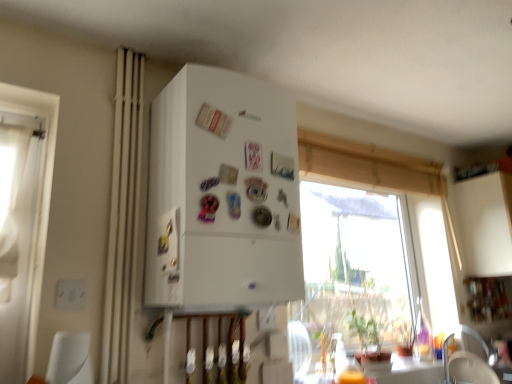
Question: Is white matte refrigerator at center at the back of white fabric armchair at lower right?

Choices:
 (A) no
 (B) yes

Answer: (A)

Question: Does white fabric armchair at lower right turn towards white matte refrigerator at center?

Choices:
 (A) no
 (B) yes

Answer: (A)

Question: Is white fabric armchair at lower right smaller than white matte refrigerator at center?

Choices:
 (A) no
 (B) yes

Answer: (B)

Question: From the image's perspective, does white fabric armchair at lower right appear higher than white matte refrigerator at center?

Choices:
 (A) yes
 (B) no

Answer: (B)

Question: Is white fabric armchair at lower right closer to the viewer compared to white matte refrigerator at center?

Choices:
 (A) no
 (B) yes

Answer: (A)

Question: Is white fabric armchair at lower right inside the boundaries of beige fabric curtain at left, or outside?

Choices:
 (A) inside
 (B) outside

Answer: (B)

Question: Would you say white fabric armchair at lower right is to the left or to the right of beige fabric curtain at left in the picture?

Choices:
 (A) left
 (B) right

Answer: (B)

Question: From their relative heights in the image, would you say white fabric armchair at lower right is taller or shorter than beige fabric curtain at left?

Choices:
 (A) short
 (B) tall

Answer: (A)

Question: In the image, is white fabric armchair at lower right positioned in front of or behind beige fabric curtain at left?

Choices:
 (A) behind
 (B) front

Answer: (A)

Question: Is white matte refrigerator at center taller or shorter than beige fabric curtain at left?

Choices:
 (A) tall
 (B) short

Answer: (B)

Question: Considering the positions of white matte refrigerator at center and beige fabric curtain at left in the image, is white matte refrigerator at center wider or thinner than beige fabric curtain at left?

Choices:
 (A) thin
 (B) wide

Answer: (B)

Question: In terms of size, does white matte refrigerator at center appear bigger or smaller than beige fabric curtain at left?

Choices:
 (A) big
 (B) small

Answer: (A)

Question: From a real-world perspective, is white matte refrigerator at center physically located above or below beige fabric curtain at left?

Choices:
 (A) below
 (B) above

Answer: (B)

Question: In terms of width, does white matte refrigerator at center look wider or thinner when compared to transparent glass window at upper center?

Choices:
 (A) thin
 (B) wide

Answer: (B)

Question: Would you say white matte refrigerator at center is inside or outside transparent glass window at upper center?

Choices:
 (A) outside
 (B) inside

Answer: (A)